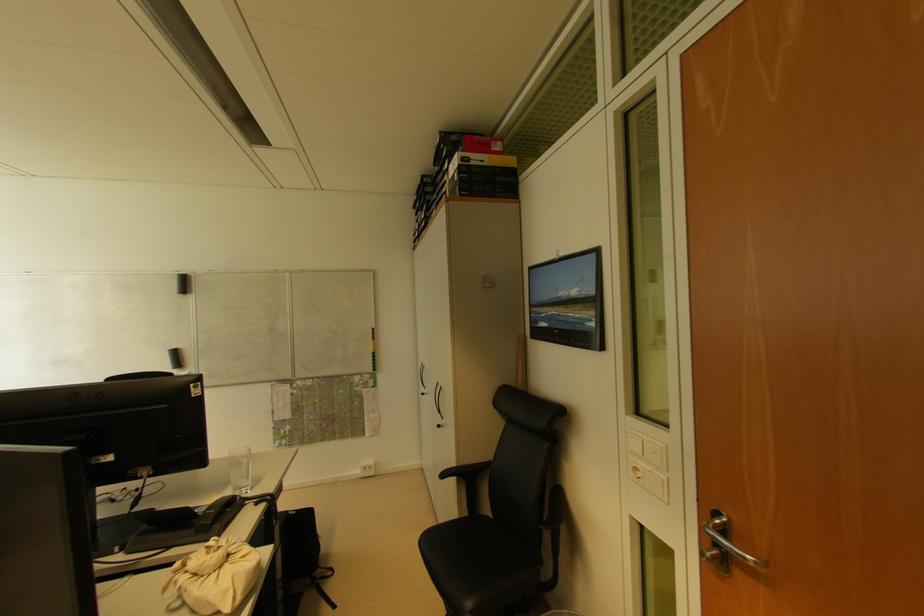
I want to click on glass cup, so click(239, 469).